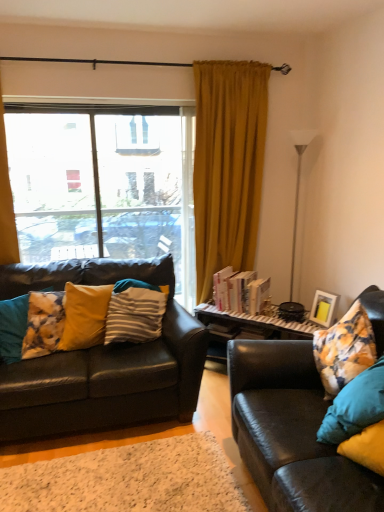
Question: Is matte yellow picture frame at right positioned beyond the bounds of white glossy floor lamp at right?

Choices:
 (A) no
 (B) yes

Answer: (B)

Question: Considering the relative positions of matte yellow picture frame at right and white glossy floor lamp at right in the image provided, is matte yellow picture frame at right to the right of white glossy floor lamp at right from the viewer's perspective?

Choices:
 (A) no
 (B) yes

Answer: (B)

Question: Can you confirm if matte yellow picture frame at right is positioned to the left of white glossy floor lamp at right?

Choices:
 (A) yes
 (B) no

Answer: (B)

Question: Can you confirm if matte yellow picture frame at right is wider than white glossy floor lamp at right?

Choices:
 (A) no
 (B) yes

Answer: (A)

Question: From a real-world perspective, is matte yellow picture frame at right positioned over white glossy floor lamp at right based on gravity?

Choices:
 (A) no
 (B) yes

Answer: (A)

Question: Is matte yellow picture frame at right in contact with white glossy floor lamp at right?

Choices:
 (A) no
 (B) yes

Answer: (A)

Question: Does hardcover books at center have a larger size compared to fluffy yellow pillow at left, arranged as the third pillow when viewed from the right?

Choices:
 (A) yes
 (B) no

Answer: (B)

Question: Is hardcover books at center not inside fluffy yellow pillow at left, arranged as the third pillow when viewed from the right?

Choices:
 (A) no
 (B) yes

Answer: (B)

Question: Considering the relative positions of hardcover books at center and fluffy yellow pillow at left, arranged as the third pillow when viewed from the right, in the image provided, is hardcover books at center to the left of fluffy yellow pillow at left, arranged as the third pillow when viewed from the right, from the viewer's perspective?

Choices:
 (A) yes
 (B) no

Answer: (B)

Question: Is hardcover books at center aimed at fluffy yellow pillow at left, arranged as the third pillow when viewed from the right?

Choices:
 (A) yes
 (B) no

Answer: (B)

Question: Considering the relative positions of hardcover books at center and fluffy yellow pillow at left, which appears as the first pillow when viewed from the left, in the image provided, is hardcover books at center behind fluffy yellow pillow at left, which appears as the first pillow when viewed from the left,?

Choices:
 (A) no
 (B) yes

Answer: (B)

Question: Can you confirm if hardcover books at center is positioned to the right of fluffy yellow pillow at left, arranged as the third pillow when viewed from the right?

Choices:
 (A) yes
 (B) no

Answer: (A)

Question: Would you say white glossy floor lamp at right is outside white textured rug at lower center?

Choices:
 (A) no
 (B) yes

Answer: (B)